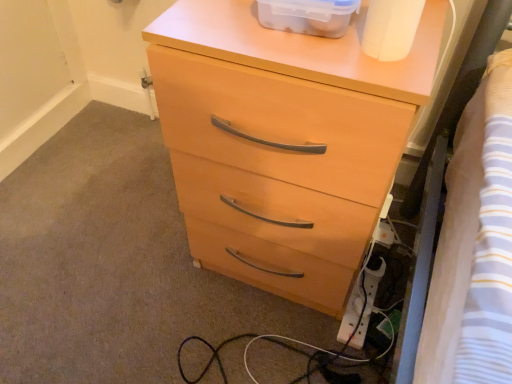
In order to click on blank space to the left of translucent plastic container at upper center in this screenshot , I will do `click(207, 21)`.